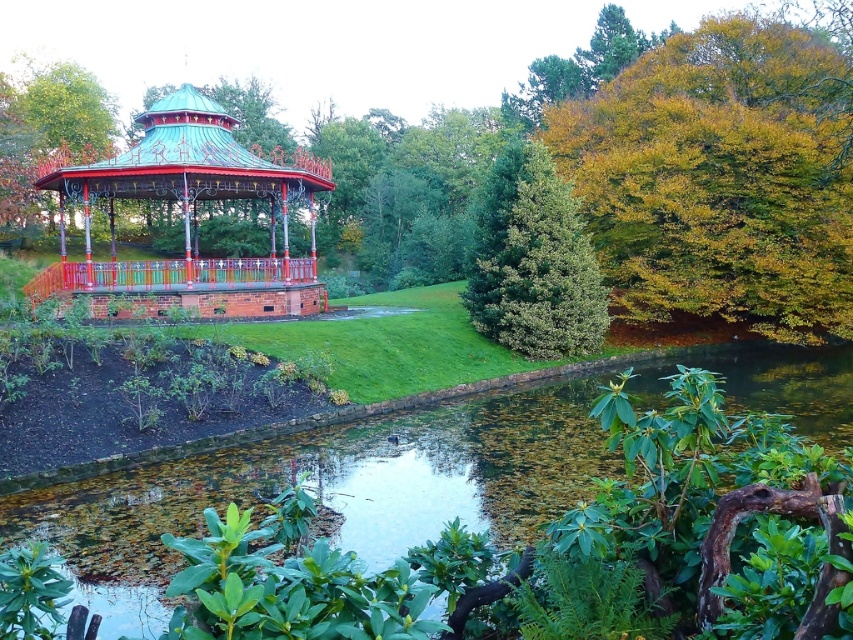
Is green leafy tree at center in front of green textured tree at center?

Yes, it is.

The height and width of the screenshot is (640, 853). Describe the element at coordinates (656, 172) in the screenshot. I see `green leafy tree at center` at that location.

This screenshot has width=853, height=640. Describe the element at coordinates (656, 172) in the screenshot. I see `green leafy tree at center` at that location.

What are the coordinates of `green leafy tree at center` in the screenshot? It's located at (656, 172).

Does point (233, 170) come farther from viewer compared to point (466, 304)?

No, it is not.

Is metallic copper gazebo at upper left to the left of green textured tree at center from the viewer's perspective?

Yes, metallic copper gazebo at upper left is to the left of green textured tree at center.

You are a GUI agent. You are given a task and a screenshot of the screen. Output one action in this format:
    pyautogui.click(x=<x>, y=<y>)
    Task: Click on the metallic copper gazebo at upper left
    The image size is (853, 640).
    Given the screenshot: What is the action you would take?
    pyautogui.click(x=187, y=220)

Describe the element at coordinates (721, 177) in the screenshot. I see `yellow-green leaves at upper right` at that location.

Does yellow-green leaves at upper right come behind green leafy water at center?

That is True.

At what (x,y) coordinates should I click in order to perform the action: click on yellow-green leaves at upper right. Please return your answer as a coordinate pair (x, y). The width and height of the screenshot is (853, 640). Looking at the image, I should click on (721, 177).